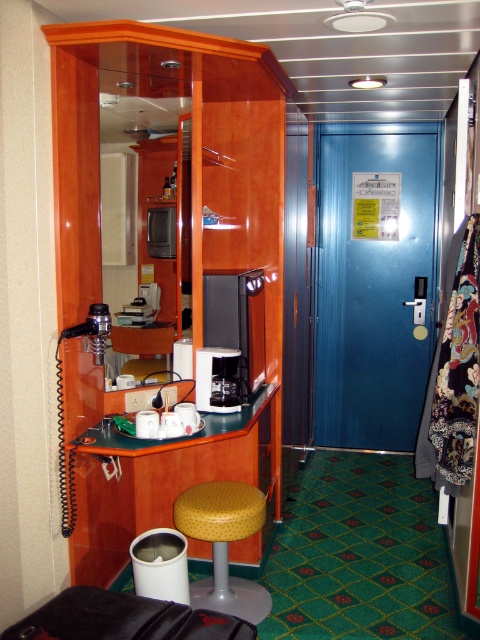
You are standing in the center of the cruise ship cabin and need to reach the black hairdryer with a coiled cord on the wall. Is the yellow textured stool at center positioned between you and the hairdryer?

The yellow textured stool at center is located at point (224, 544), which is closer to the wall where the black hairdryer with a coiled cord is hanging. Since the stool is positioned between the center of the cabin and the hairdryer, it would obstruct your path. Therefore, you would need to move the stool to access the hairdryer.

Looking at this image, you are a cabin steward on a cruise ship who needs to clean the area between the yellow textured stool at center and the satin black coffee machine at center. The cleaning equipment you have is 20 inches wide. Can you fit your equipment through the space between them?

The distance between the yellow textured stool at center and the satin black coffee machine at center is 21.69 inches. Since the cleaning equipment is 20 inches wide, it should fit through the space as there is enough clearance.